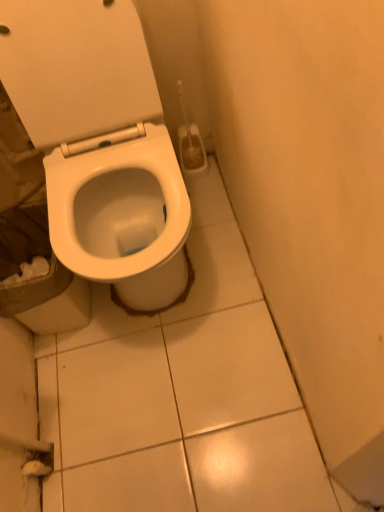
This screenshot has height=512, width=384. What do you see at coordinates (98, 138) in the screenshot?
I see `white glossy toilet at center` at bounding box center [98, 138].

What is the approximate width of white glossy toilet at center?

It is 27.44 inches.

Find the location of a particular element. Image resolution: width=384 pixels, height=512 pixels. white glossy toilet at center is located at coordinates tap(98, 138).

Measure the distance between point (x=93, y=176) and camera.

Point (x=93, y=176) and camera are 3.99 feet apart.

Identify the location of white glossy toilet at center. (98, 138).